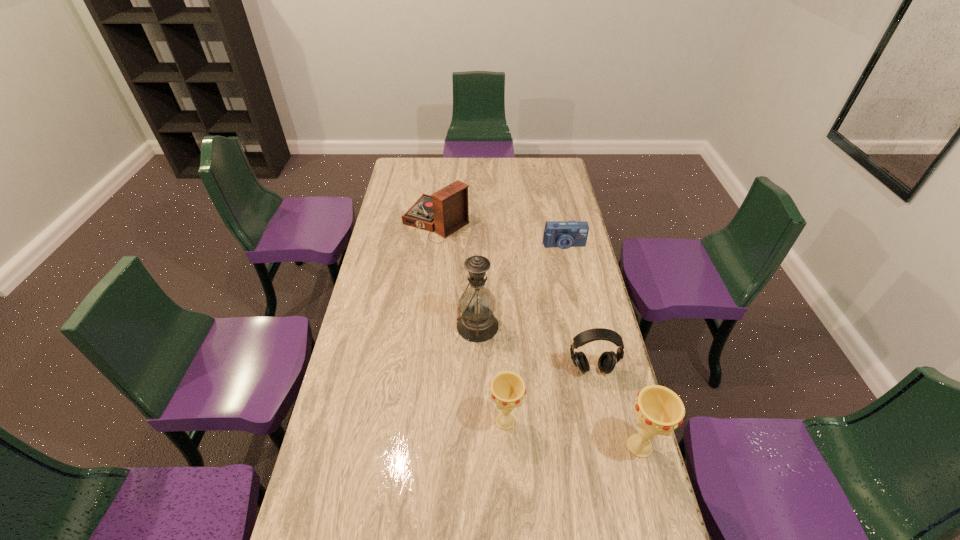
Find the location of a particular element. The image size is (960, 540). free space located 0.080m on the lens of the shortest object is located at coordinates (567, 263).

Where is `blank space located on the ear cups of the fourth farthest object`? The image size is (960, 540). blank space located on the ear cups of the fourth farthest object is located at coordinates (597, 395).

The width and height of the screenshot is (960, 540). Find the location of `vacant space positioned on the left of the third farthest object`. vacant space positioned on the left of the third farthest object is located at coordinates (428, 326).

The height and width of the screenshot is (540, 960). What are the coordinates of `object that is at the left edge` in the screenshot? It's located at point(447,210).

Find the location of a particular element. This screenshot has width=960, height=540. chalice that is at the right edge is located at coordinates (658, 410).

Image resolution: width=960 pixels, height=540 pixels. I want to click on camera present at the right edge, so click(564, 234).

This screenshot has height=540, width=960. Find the location of `earphone that is at the right edge`. earphone that is at the right edge is located at coordinates (607, 361).

The height and width of the screenshot is (540, 960). What are the coordinates of `free location at the left edge of the desktop` in the screenshot? It's located at [410, 259].

Locate an element on the screen. Image resolution: width=960 pixels, height=540 pixels. free space at the right edge of the desktop is located at coordinates (602, 349).

The height and width of the screenshot is (540, 960). What are the coordinates of `vacant space that is in between the third nearest object and the shorter chalice` in the screenshot? It's located at (548, 395).